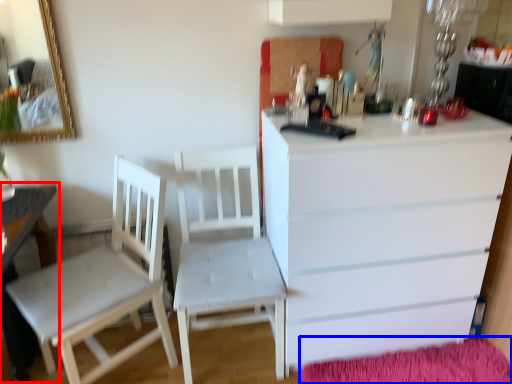
Question: Which object appears closest to the camera in this image, table (highlighted by a red box) or mat (highlighted by a blue box)?

Choices:
 (A) table
 (B) mat

Answer: (A)